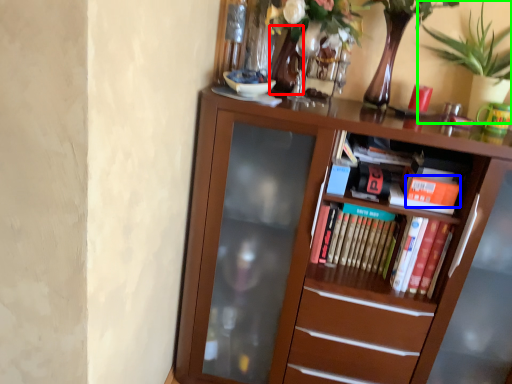
Question: Which object is positioned closest to vase (highlighted by a red box)? Select from paperback book (highlighted by a blue box) and houseplant (highlighted by a green box).

Choices:
 (A) paperback book
 (B) houseplant

Answer: (B)